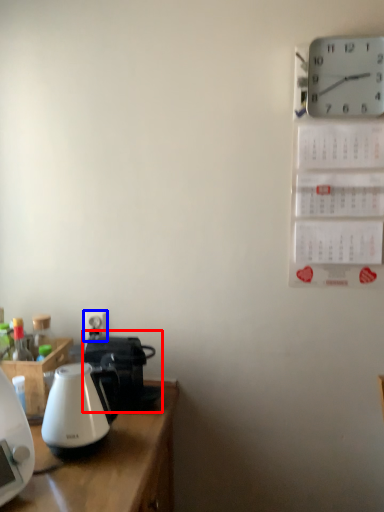
Question: Which of the following is the farthest to the observer, coffeepot (highlighted by a red box) or electric outlet (highlighted by a blue box)?

Choices:
 (A) coffeepot
 (B) electric outlet

Answer: (B)